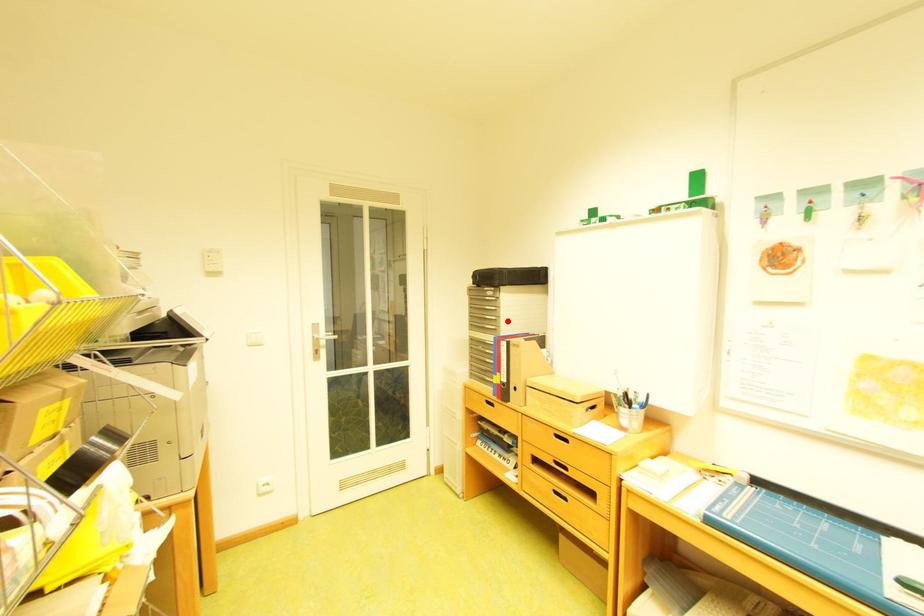
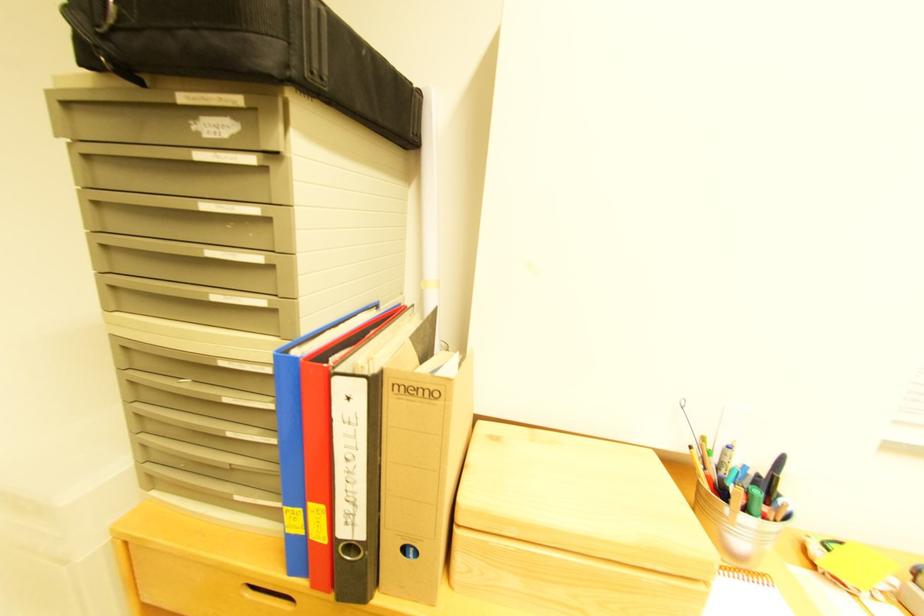
Locate, in the second image, the point that corresponds to the highlighted location in the first image.

(282, 268)